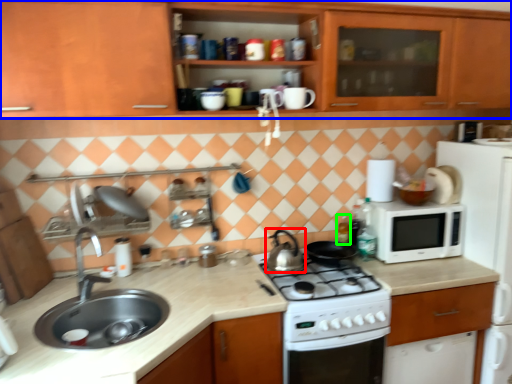
Question: Which object is positioned closest to kitchen appliance (highlighted by a red box)? Select from cabinetry (highlighted by a blue box) and bottle (highlighted by a green box).

Choices:
 (A) cabinetry
 (B) bottle

Answer: (B)